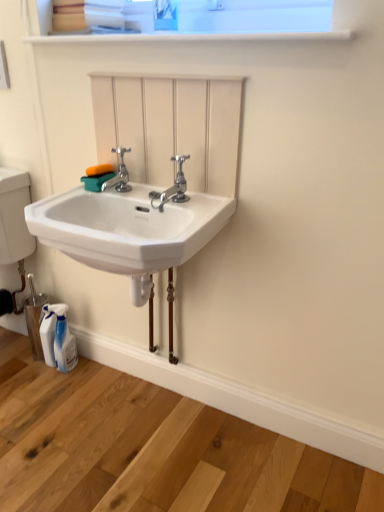
Question: Can you confirm if polished chrome faucet at center, which is the first tap from right to left, is positioned to the left of chrome metallic faucet at center, which is the second tap from right to left?

Choices:
 (A) no
 (B) yes

Answer: (A)

Question: From a real-world perspective, is polished chrome faucet at center, the 2th tap from the left, physically below chrome metallic faucet at center, which is the second tap from right to left?

Choices:
 (A) no
 (B) yes

Answer: (B)

Question: Could you tell me if polished chrome faucet at center, the 2th tap from the left, is turned towards chrome metallic faucet at center, acting as the first tap starting from the left?

Choices:
 (A) yes
 (B) no

Answer: (B)

Question: Can you confirm if polished chrome faucet at center, the 2th tap from the left, is shorter than chrome metallic faucet at center, acting as the first tap starting from the left?

Choices:
 (A) no
 (B) yes

Answer: (A)

Question: From the image's perspective, is polished chrome faucet at center, the 2th tap from the left, below chrome metallic faucet at center, acting as the first tap starting from the left?

Choices:
 (A) no
 (B) yes

Answer: (B)

Question: Which is correct: white glossy spray bottle at lower left is inside chrome metallic faucet at center, acting as the first tap starting from the left, or outside of it?

Choices:
 (A) inside
 (B) outside

Answer: (B)

Question: In terms of size, does white glossy spray bottle at lower left appear bigger or smaller than chrome metallic faucet at center, acting as the first tap starting from the left?

Choices:
 (A) big
 (B) small

Answer: (A)

Question: In terms of height, does white glossy spray bottle at lower left look taller or shorter compared to chrome metallic faucet at center, acting as the first tap starting from the left?

Choices:
 (A) short
 (B) tall

Answer: (B)

Question: Is point (59, 318) positioned closer to the camera than point (105, 181)?

Choices:
 (A) closer
 (B) farther

Answer: (B)

Question: From the image's perspective, relative to white ceramic sink at center, is white glossy shelf at upper center above or below?

Choices:
 (A) above
 (B) below

Answer: (A)

Question: Is white glossy shelf at upper center taller or shorter than white ceramic sink at center?

Choices:
 (A) tall
 (B) short

Answer: (B)

Question: In terms of width, does white glossy shelf at upper center look wider or thinner when compared to white ceramic sink at center?

Choices:
 (A) thin
 (B) wide

Answer: (B)

Question: From a real-world perspective, is white glossy shelf at upper center positioned above or below white ceramic sink at center?

Choices:
 (A) above
 (B) below

Answer: (A)

Question: Is polished chrome faucet at center, the 2th tap from the left, bigger or smaller than white glossy shelf at upper center?

Choices:
 (A) big
 (B) small

Answer: (B)

Question: Is point (170, 158) closer or farther from the camera than point (241, 37)?

Choices:
 (A) farther
 (B) closer

Answer: (A)